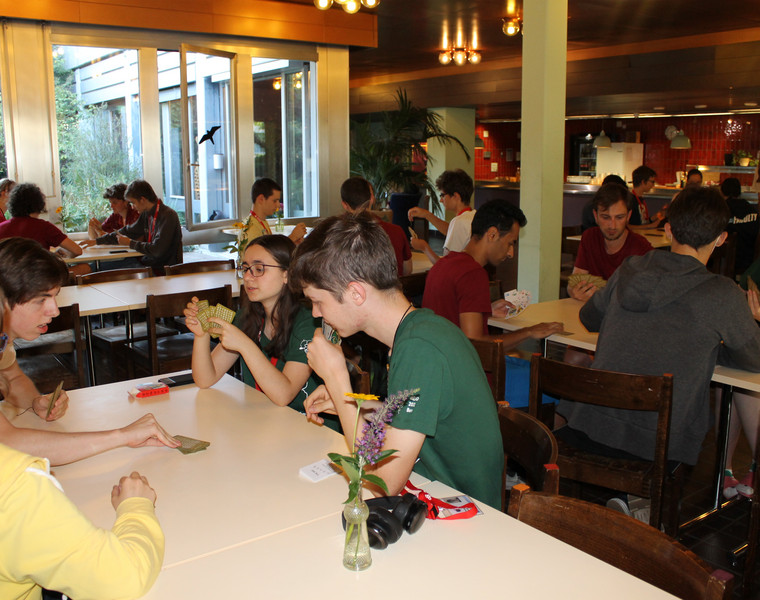
Where is `vase of flowers`? This screenshot has height=600, width=760. vase of flowers is located at coordinates [x=356, y=514].